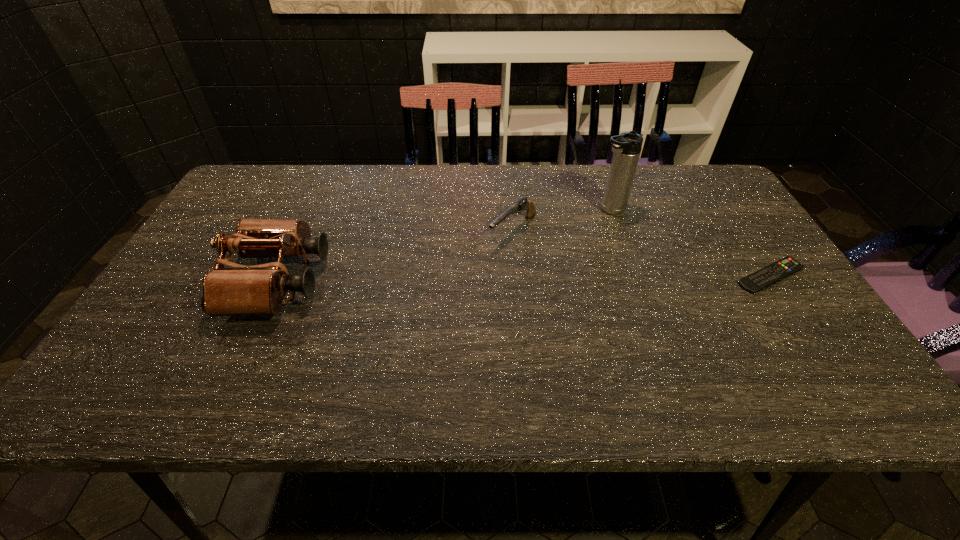
Find the location of a particular element. vacant space on the desktop that is between the leftmost object and the shortest object and is positioned on the handle side of the thermos bottle is located at coordinates (478, 279).

The width and height of the screenshot is (960, 540). In order to click on free space on the desktop that is between the second tallest object and the shortest object and is positioned aiming along the barrel of the gun in this screenshot , I will do `click(460, 279)`.